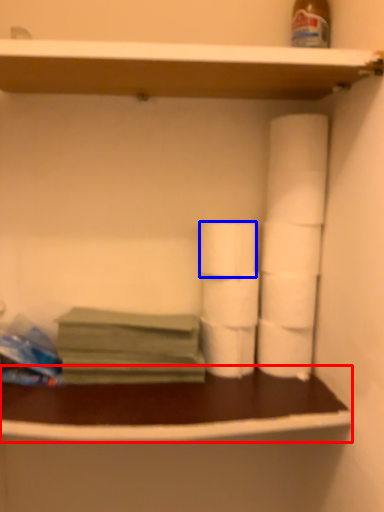
Question: Which object is further to the camera taking this photo, counter (highlighted by a red box) or toilet paper (highlighted by a blue box)?

Choices:
 (A) counter
 (B) toilet paper

Answer: (B)